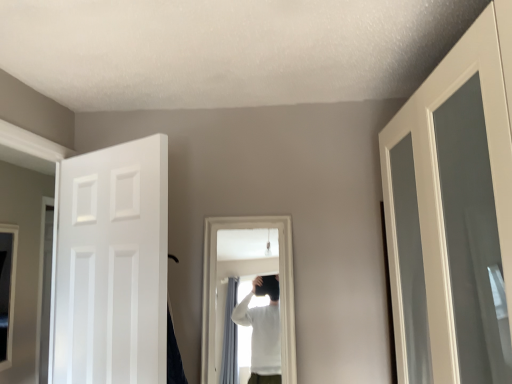
The height and width of the screenshot is (384, 512). I want to click on white matte door at left, so click(x=112, y=266).

Image resolution: width=512 pixels, height=384 pixels. What do you see at coordinates (112, 266) in the screenshot?
I see `white matte door at left` at bounding box center [112, 266].

Locate an element on the screen. The width and height of the screenshot is (512, 384). white matte door at left is located at coordinates (112, 266).